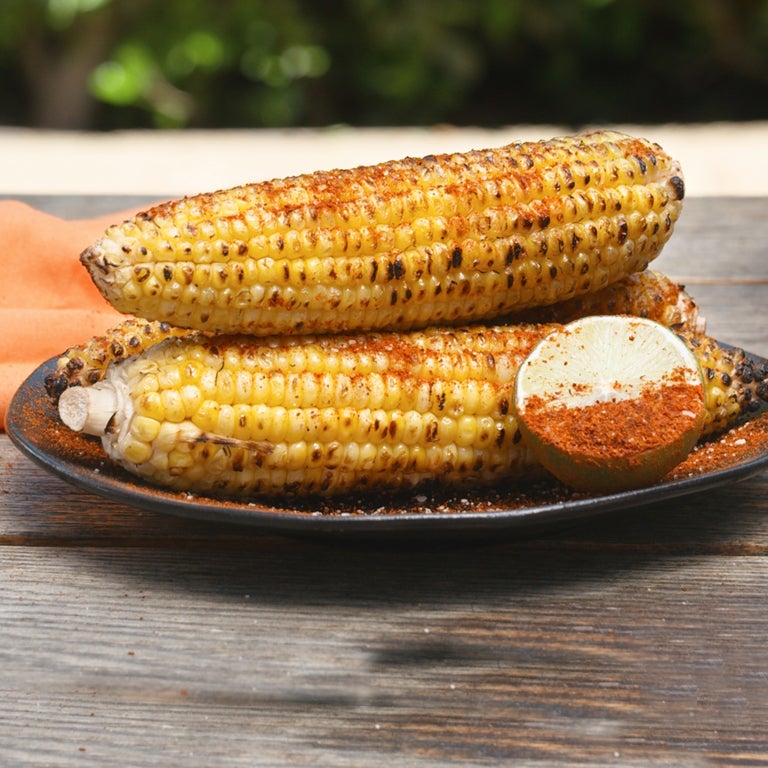
You are a GUI agent. You are given a task and a screenshot of the screen. Output one action in this format:
    pyautogui.click(x=<x>, y=<y>)
    Task: Click on the plate
    
    Given the screenshot: What is the action you would take?
    pyautogui.click(x=384, y=518)